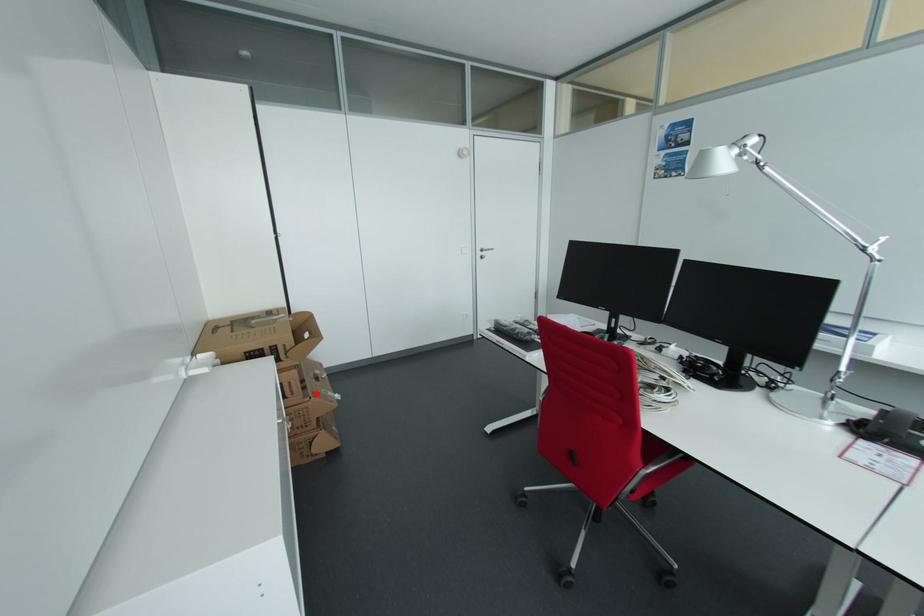
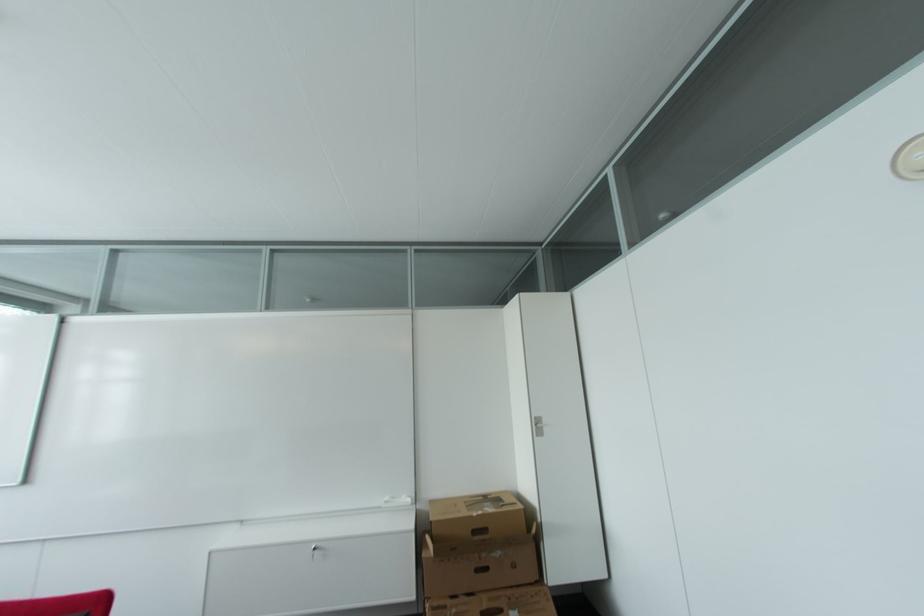
Where in the second image is the point corresponding to the highlighted location from the first image?

(448, 609)